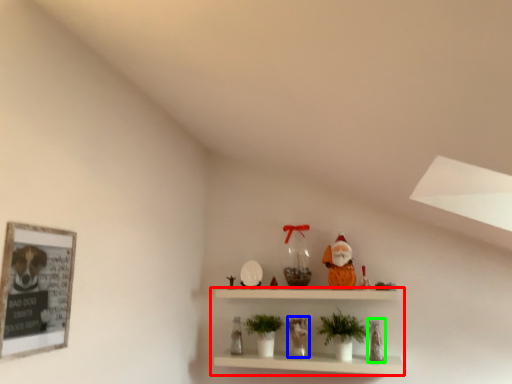
Question: Estimate the real-world distances between objects in this image. Which object is closer to shelf (highlighted by a red box), toy (highlighted by a blue box) or toy (highlighted by a green box)?

Choices:
 (A) toy
 (B) toy

Answer: (A)